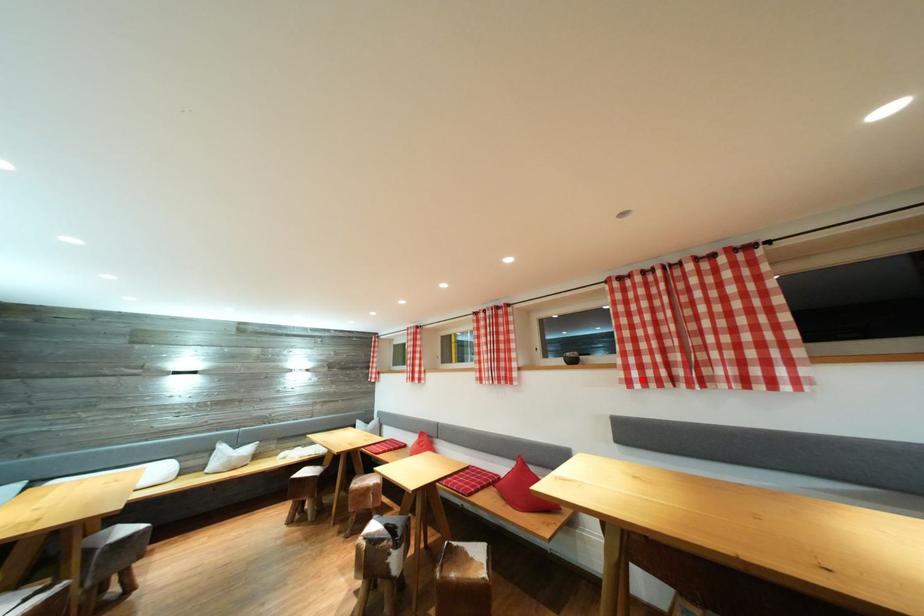
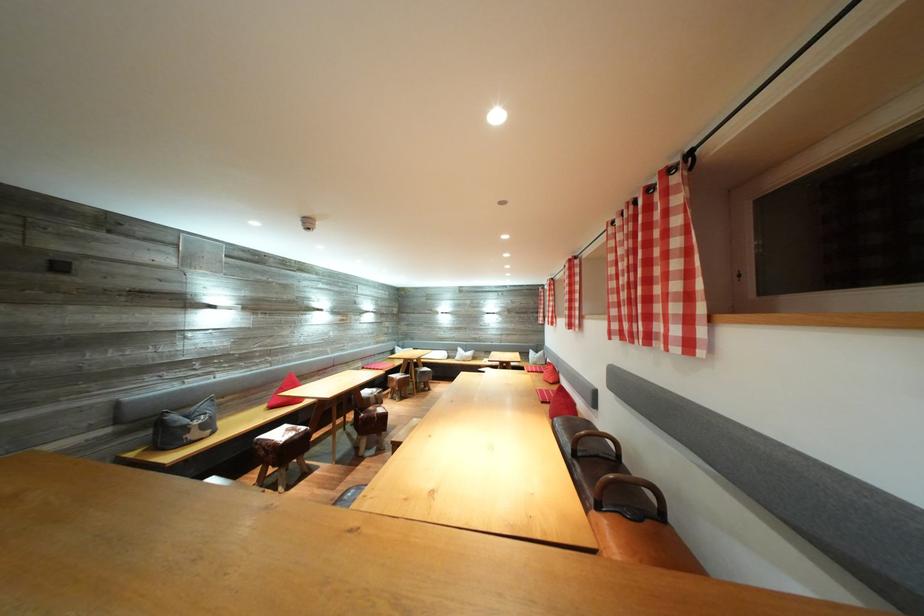
In the second image, find the point that corresponds to the highlighted location in the first image.

(622, 331)